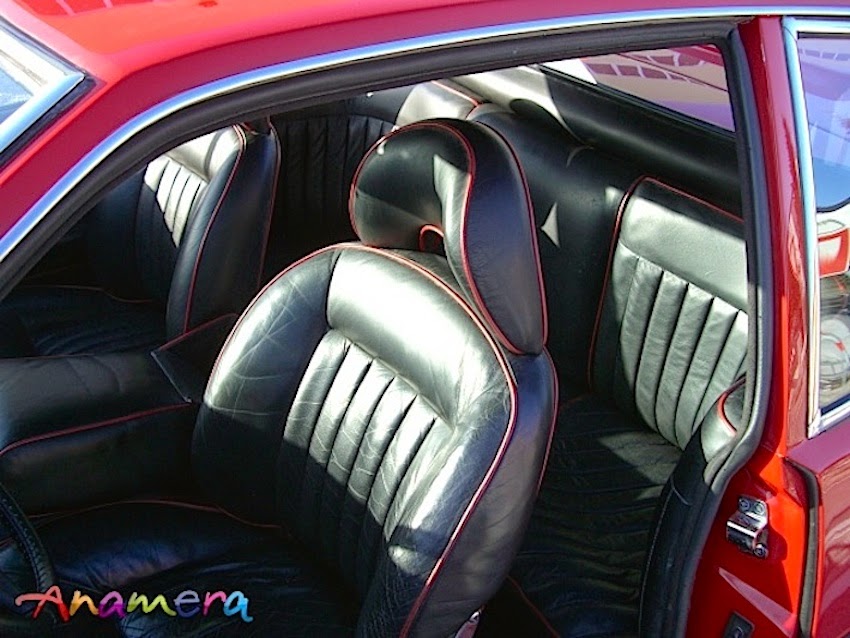
This screenshot has width=850, height=638. Identify the location of seat. (112, 332).